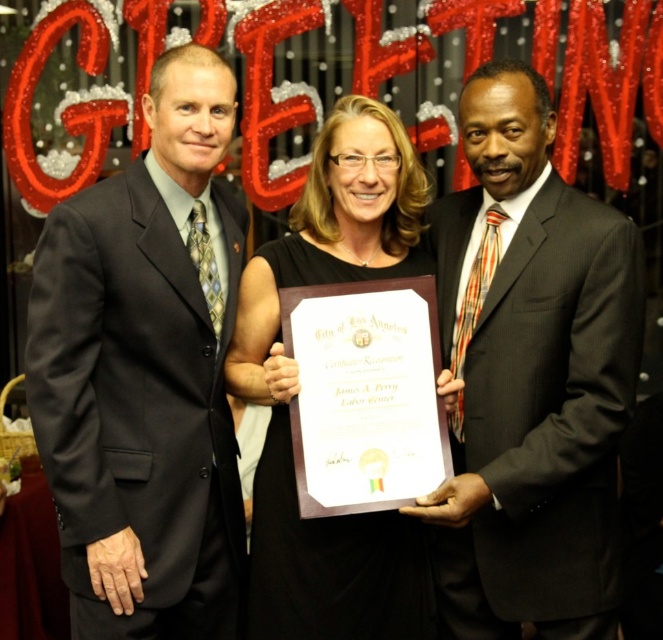
Does matte black suit at left have a greater height compared to matte black suit at center?

Yes, matte black suit at left is taller than matte black suit at center.

The height and width of the screenshot is (640, 663). Describe the element at coordinates (145, 372) in the screenshot. I see `matte black suit at left` at that location.

This screenshot has height=640, width=663. What are the coordinates of `matte black suit at left` in the screenshot? It's located at (145, 372).

Which is below, matte black suit at left or black satin dress at center?

black satin dress at center is below.

Between matte black suit at left and black satin dress at center, which one is positioned higher?

matte black suit at left is above.

At what (x,y) coordinates should I click in order to perform the action: click on matte black suit at left. Please return your answer as a coordinate pair (x, y). Looking at the image, I should click on (x=145, y=372).

How distant is matte black suit at center from black satin dress at center?

14.31 inches

Does matte black suit at center lie in front of black satin dress at center?

Yes, matte black suit at center is closer to the viewer.

Who is more forward, [516,566] or [280,506]?

Positioned in front is point [516,566].

Find the location of a particular element. The height and width of the screenshot is (640, 663). matte black suit at center is located at coordinates (530, 378).